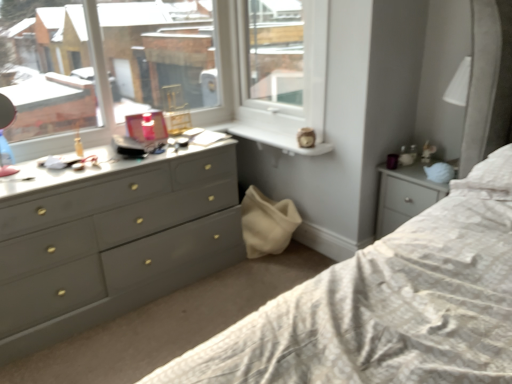
Question: Is white plastic window frame at upper center taller than matte gray dresser at left?

Choices:
 (A) no
 (B) yes

Answer: (B)

Question: Does white plastic window frame at upper center have a smaller size compared to matte gray dresser at left?

Choices:
 (A) yes
 (B) no

Answer: (A)

Question: From a real-world perspective, is white plastic window frame at upper center located higher than matte gray dresser at left?

Choices:
 (A) no
 (B) yes

Answer: (B)

Question: Does white plastic window frame at upper center turn towards matte gray dresser at left?

Choices:
 (A) no
 (B) yes

Answer: (B)

Question: Are white plastic window frame at upper center and matte gray dresser at left making contact?

Choices:
 (A) yes
 (B) no

Answer: (B)

Question: Can you confirm if white plastic window frame at upper center is positioned to the right of matte gray dresser at left?

Choices:
 (A) no
 (B) yes

Answer: (B)

Question: Can you confirm if matte gray dresser at left is positioned to the left of white plastic window frame at upper center?

Choices:
 (A) yes
 (B) no

Answer: (A)

Question: From the image's perspective, would you say matte gray dresser at left is positioned over white plastic window frame at upper center?

Choices:
 (A) yes
 (B) no

Answer: (B)

Question: Does matte gray dresser at left have a lesser width compared to white plastic window frame at upper center?

Choices:
 (A) yes
 (B) no

Answer: (B)

Question: Is matte gray dresser at left located outside white plastic window frame at upper center?

Choices:
 (A) yes
 (B) no

Answer: (A)

Question: Can you confirm if matte gray dresser at left is smaller than white plastic window frame at upper center?

Choices:
 (A) no
 (B) yes

Answer: (A)

Question: Is the surface of matte gray dresser at left in direct contact with white plastic window frame at upper center?

Choices:
 (A) yes
 (B) no

Answer: (B)

Question: Considering the relative positions of white plastic window frame at upper center and matte gray dresser at left in the image provided, is white plastic window frame at upper center to the left or to the right of matte gray dresser at left?

Choices:
 (A) left
 (B) right

Answer: (B)